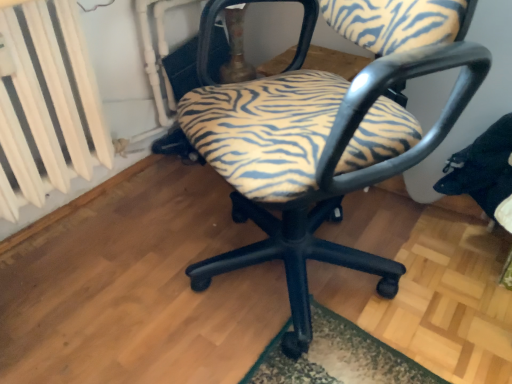
What do you see at coordinates (324, 135) in the screenshot? Image resolution: width=512 pixels, height=384 pixels. I see `zebra-patterned fabric chair at center` at bounding box center [324, 135].

The width and height of the screenshot is (512, 384). In order to click on zebra-patterned fabric chair at center in this screenshot , I will do `click(324, 135)`.

Locate an element on the screen. This screenshot has width=512, height=384. white painted metal radiator at left is located at coordinates (33, 101).

Describe the element at coordinates (33, 101) in the screenshot. I see `white painted metal radiator at left` at that location.

Identify the location of zebra-patterned fabric chair at center. pyautogui.click(x=324, y=135).

Which object is positioned more to the right, white painted metal radiator at left or zebra-patterned fabric chair at center?

zebra-patterned fabric chair at center.

Which is in front, white painted metal radiator at left or zebra-patterned fabric chair at center?

zebra-patterned fabric chair at center is closer to the camera.

Is point (77, 37) positioned behind point (364, 154)?

Yes, it is.

From the image's perspective, would you say white painted metal radiator at left is positioned over zebra-patterned fabric chair at center?

Yes.

From a real-world perspective, who is located higher, white painted metal radiator at left or zebra-patterned fabric chair at center?

In real-world perspective, white painted metal radiator at left is above.

Which of these two, white painted metal radiator at left or zebra-patterned fabric chair at center, is thinner?

With smaller width is white painted metal radiator at left.

Which of these two, white painted metal radiator at left or zebra-patterned fabric chair at center, stands taller?

zebra-patterned fabric chair at center.

Can you confirm if white painted metal radiator at left is bigger than zebra-patterned fabric chair at center?

No.

Which is correct: white painted metal radiator at left is inside zebra-patterned fabric chair at center, or outside of it?

white painted metal radiator at left is located beyond the bounds of zebra-patterned fabric chair at center.

Is white painted metal radiator at left with zebra-patterned fabric chair at center?

No, white painted metal radiator at left is not with zebra-patterned fabric chair at center.

Could you tell me if white painted metal radiator at left is facing zebra-patterned fabric chair at center?

Yes, white painted metal radiator at left is oriented towards zebra-patterned fabric chair at center.

You are a GUI agent. You are given a task and a screenshot of the screen. Output one action in this format:
    pyautogui.click(x=<x>, y=<y>)
    Task: Click on the chair on the right side of white painted metal radiator at left
    The width and height of the screenshot is (512, 384).
    Given the screenshot: What is the action you would take?
    pyautogui.click(x=324, y=135)

Which is more to the left, zebra-patterned fabric chair at center or white painted metal radiator at left?

Positioned to the left is white painted metal radiator at left.

Between zebra-patterned fabric chair at center and white painted metal radiator at left, which one is positioned behind?

white painted metal radiator at left is further from the camera.

Considering the points (244, 88) and (50, 130), which point is behind, point (244, 88) or point (50, 130)?

The point (50, 130) is farther from the camera.

From the image's perspective, is zebra-patterned fabric chair at center on top of white painted metal radiator at left?

No, from the image's perspective, zebra-patterned fabric chair at center is not over white painted metal radiator at left.

From a real-world perspective, is zebra-patterned fabric chair at center over white painted metal radiator at left?

No, from a real-world perspective, zebra-patterned fabric chair at center is not above white painted metal radiator at left.

Which of these two, zebra-patterned fabric chair at center or white painted metal radiator at left, is thinner?

Thinner between the two is white painted metal radiator at left.

Considering the sizes of zebra-patterned fabric chair at center and white painted metal radiator at left in the image, is zebra-patterned fabric chair at center taller or shorter than white painted metal radiator at left?

zebra-patterned fabric chair at center is taller than white painted metal radiator at left.

Does zebra-patterned fabric chair at center have a larger size compared to white painted metal radiator at left?

Yes.

Do you think zebra-patterned fabric chair at center is within white painted metal radiator at left, or outside of it?

zebra-patterned fabric chair at center is spatially situated outside white painted metal radiator at left.

Is the surface of zebra-patterned fabric chair at center in direct contact with white painted metal radiator at left?

No, zebra-patterned fabric chair at center is not next to white painted metal radiator at left.

Is zebra-patterned fabric chair at center facing towards white painted metal radiator at left?

No, zebra-patterned fabric chair at center is not facing towards white painted metal radiator at left.

How many degrees apart are the facing directions of zebra-patterned fabric chair at center and white painted metal radiator at left?

116 degrees.

Where is `radiator behind the zebra-patterned fabric chair at center`? radiator behind the zebra-patterned fabric chair at center is located at coordinates (33, 101).

Identify the location of chair below the white painted metal radiator at left (from the image's perspective). This screenshot has width=512, height=384. (324, 135).

Identify the location of radiator that appears above the zebra-patterned fabric chair at center (from the image's perspective). This screenshot has width=512, height=384. (33, 101).